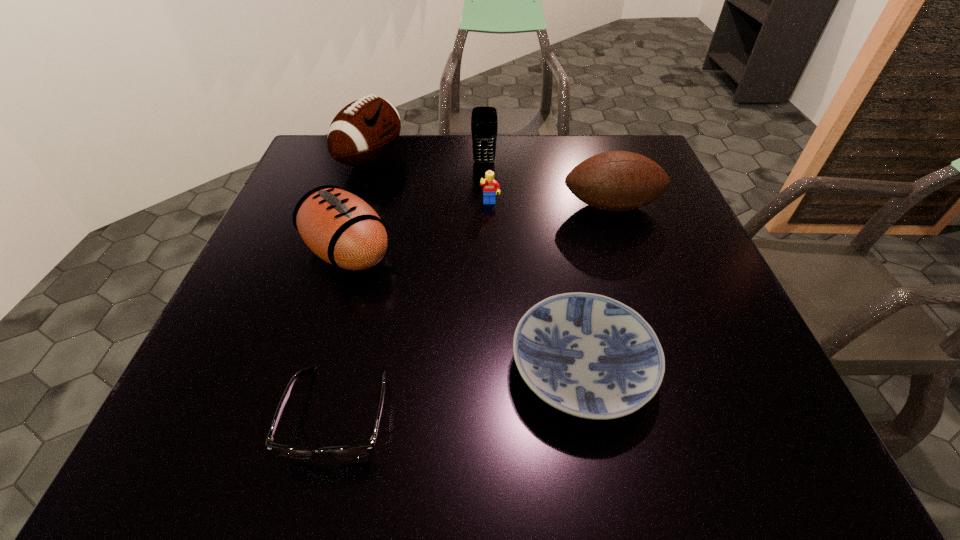
Identify the location of football (American) identified as the closest to the rightmost football (American). The image size is (960, 540). (339, 227).

Identify the location of vacant point that satisfies the following two spatial constraints: 1. on the face of the plate; 2. on the left side of the third shortest object. (494, 369).